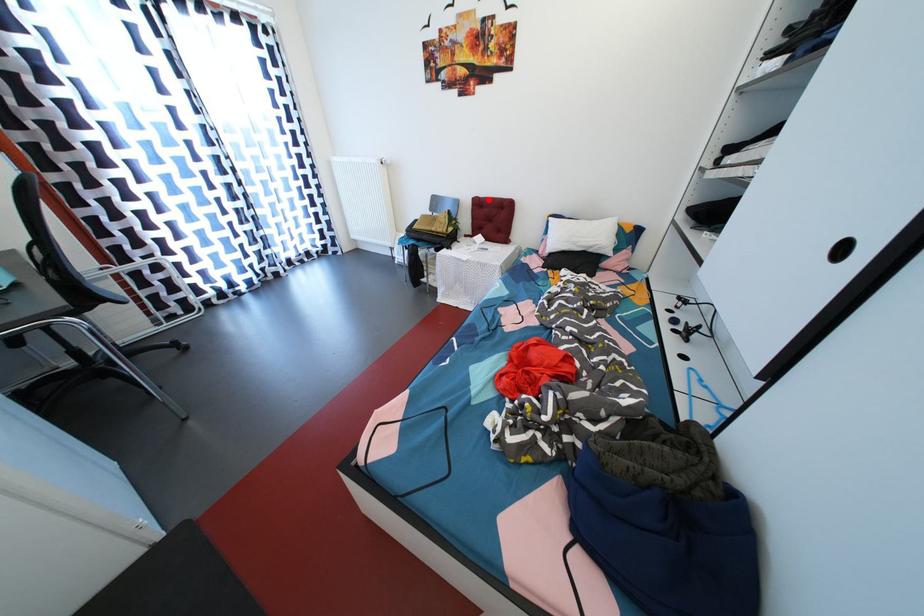
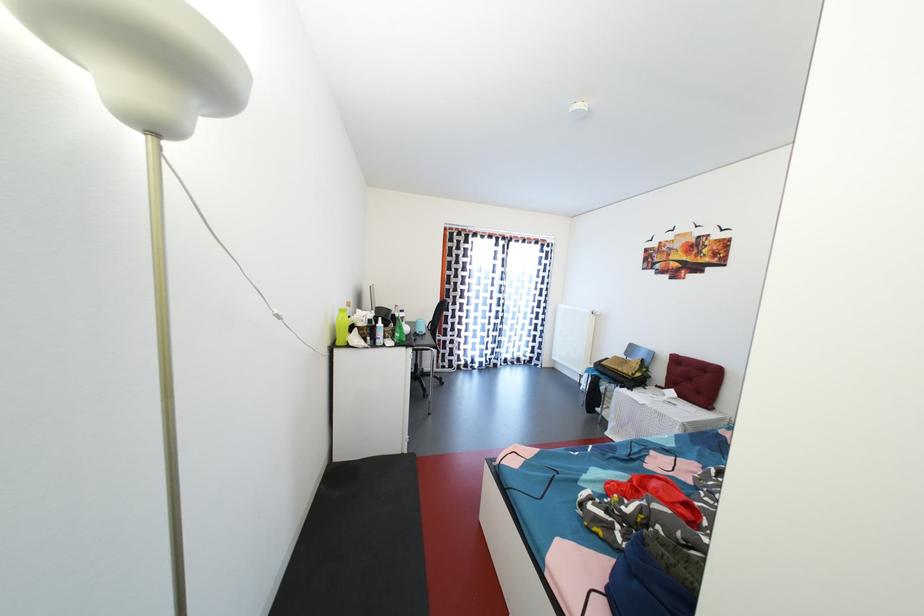
Question: I am providing you with two images of the same scene from different viewpoints. Given a red point in image1, look at the same physical point in image2. Is it:

Choices:
 (A) Closer to the viewpoint
 (B) Farther from the viewpoint

Answer: (B)